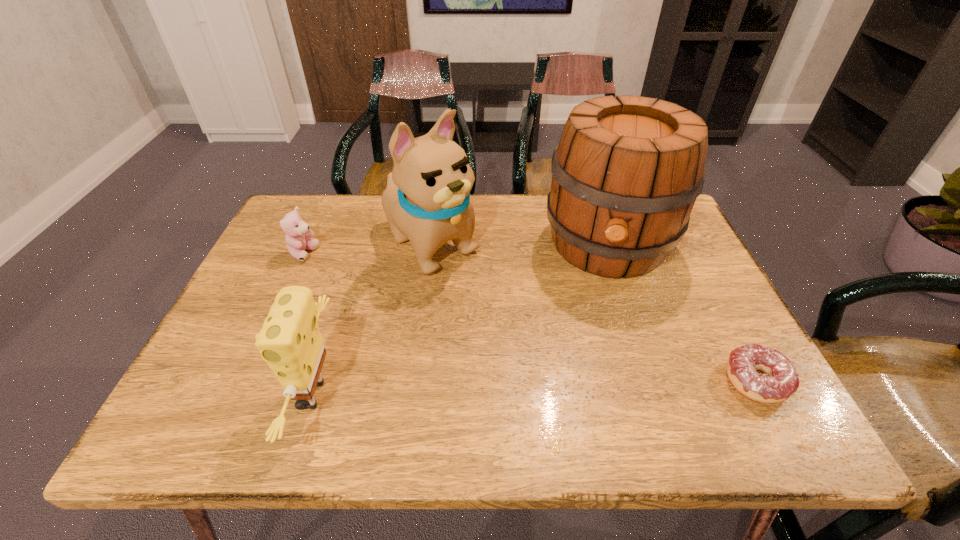
In the image, there is a desktop. Identify the location of vacant space at the left edge. The image size is (960, 540). (253, 307).

Identify the location of vacant space at the right edge. This screenshot has height=540, width=960. (708, 301).

The width and height of the screenshot is (960, 540). Identify the location of blank space at the far left corner of the desktop. (336, 195).

This screenshot has width=960, height=540. In order to click on vacant space at the near left corner of the desktop in this screenshot , I will do `click(249, 383)`.

The height and width of the screenshot is (540, 960). What are the coordinates of `free space between the teddy bear and the cider` in the screenshot? It's located at (456, 249).

Image resolution: width=960 pixels, height=540 pixels. I want to click on empty space between the cider and the second shortest object, so click(456, 249).

Where is `empty space that is in between the puppy and the shortest object`? Image resolution: width=960 pixels, height=540 pixels. empty space that is in between the puppy and the shortest object is located at coordinates (593, 313).

Find the location of a particular element. empty space between the shortest object and the fourth tallest object is located at coordinates (530, 318).

This screenshot has width=960, height=540. In order to click on free spot between the teddy bear and the cider in this screenshot , I will do `click(456, 249)`.

This screenshot has width=960, height=540. Identify the location of vacant region between the doughnut and the cider. (683, 313).